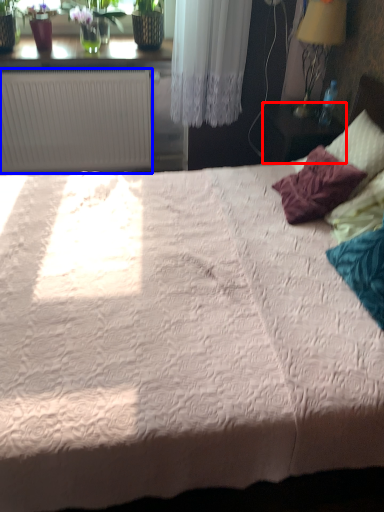
Question: Which point is closer to the camera, table (highlighted by a red box) or radiator (highlighted by a blue box)?

Choices:
 (A) table
 (B) radiator

Answer: (A)